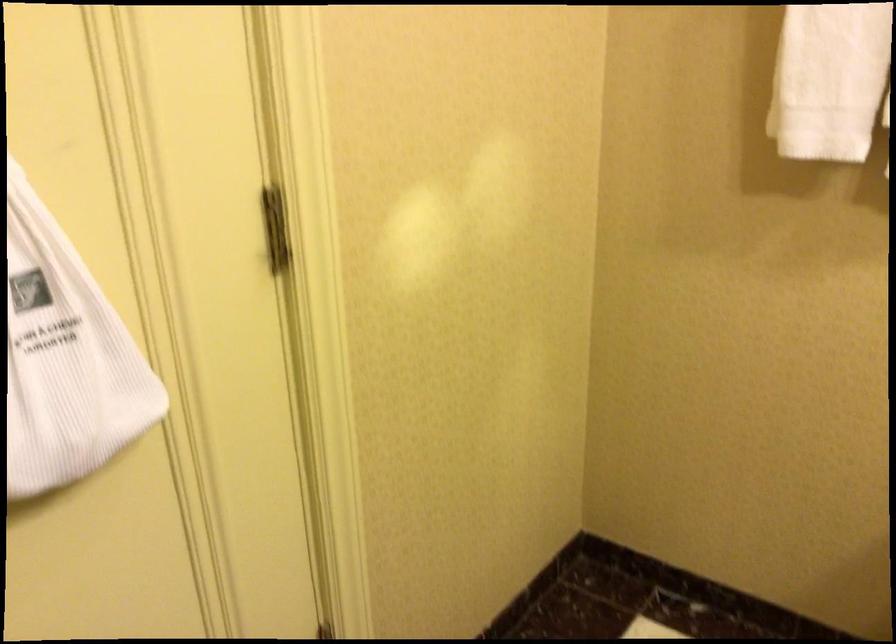
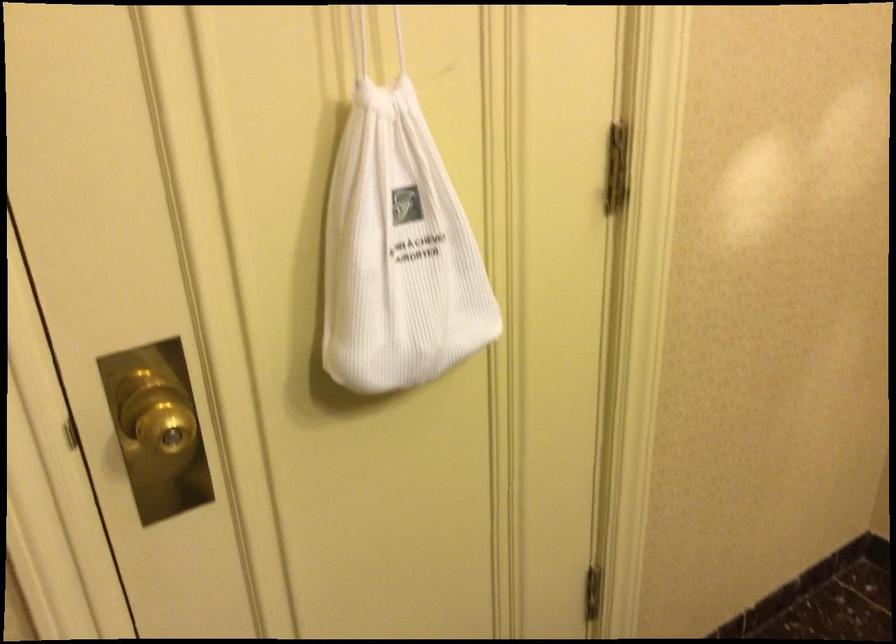
Question: The images are taken continuously from a first-person perspective. In which direction is your viewpoint rotating?

Choices:
 (A) Left
 (B) Right
 (C) Up
 (D) Down

Answer: (A)